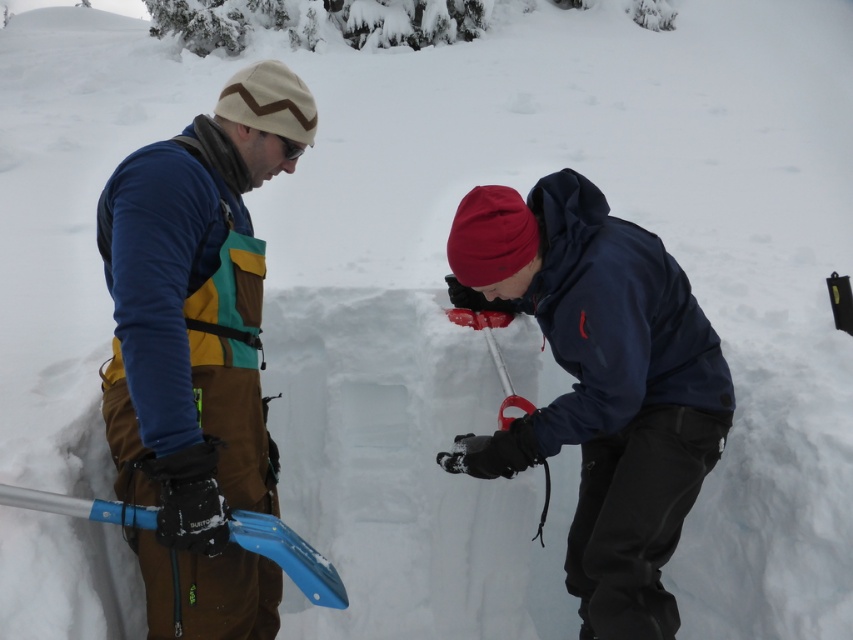
You are planning to take a photo of the dark blue jacket at center. The camera is 9.12 feet away from the jacket. Is this distance sufficient to capture the entire jacket in the photo?

The dark blue jacket at center and camera are 9.12 feet apart. This distance may be sufficient to capture the entire jacket in the photo, but it depends on the camera lens and zoom capabilities. A standard lens might require being closer, while a wide angle or zoom lens could capture it from this distance.

You are planning to store the matte blue snow shovel at left and the dark blue jacket at center in a vertical closet. Given their sizes, which one will require more vertical space?

The matte blue snow shovel at left requires more vertical space because it has a greater height than the dark blue jacket at center according to the description.

You are an observer standing in front of the snowy scene. You see the matte blue snow shovel at left and the dark blue jacket at center. Which object is closer to you?

The matte blue snow shovel at left is positioned over the dark blue jacket at center, meaning it is closer to you.